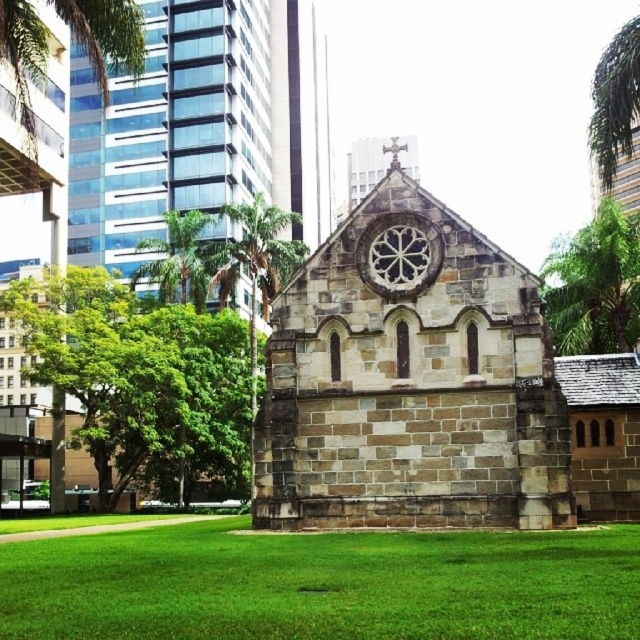
Measure the distance from green grass at lower center to green leafy palm tree at right.

They are 128.35 feet apart.

You are a GUI agent. You are given a task and a screenshot of the screen. Output one action in this format:
    pyautogui.click(x=<x>, y=<y>)
    Task: Click on the green grass at lower center
    The width and height of the screenshot is (640, 640).
    Given the screenshot: What is the action you would take?
    pyautogui.click(x=321, y=584)

Between point (106, 614) and point (632, 285), which one is positioned in front?

Point (106, 614)

The image size is (640, 640). I want to click on green grass at lower center, so click(321, 584).

Can you confirm if brown stone chapel at center is shorter than green grass at lower center?

In fact, brown stone chapel at center may be taller than green grass at lower center.

Does point (410, 355) lie in front of point (433, 582)?

That is False.

Where is `brown stone chapel at center`? brown stone chapel at center is located at coordinates (410, 380).

Can you confirm if green leafy palm tree at right is positioned above green leafy tree at upper left?

Incorrect, green leafy palm tree at right is not positioned above green leafy tree at upper left.

What do you see at coordinates (595, 284) in the screenshot? I see `green leafy palm tree at right` at bounding box center [595, 284].

Identify the location of green leafy palm tree at right. (595, 284).